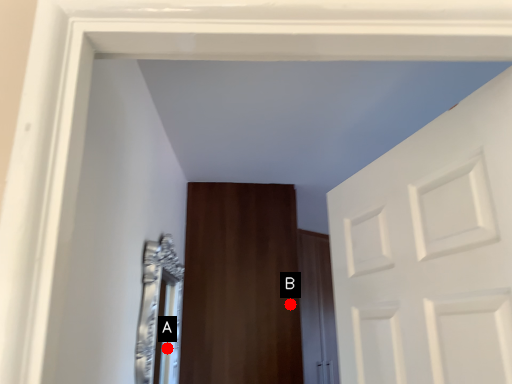
Question: Two points are circled on the image, labeled by A and B beside each circle. Which point is closer to the camera?

Choices:
 (A) A is closer
 (B) B is closer

Answer: (A)